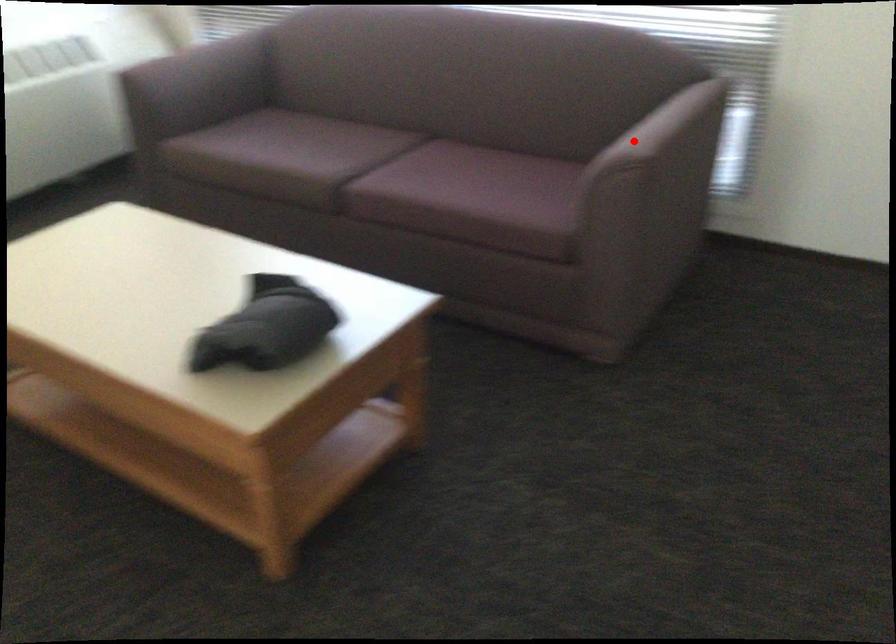
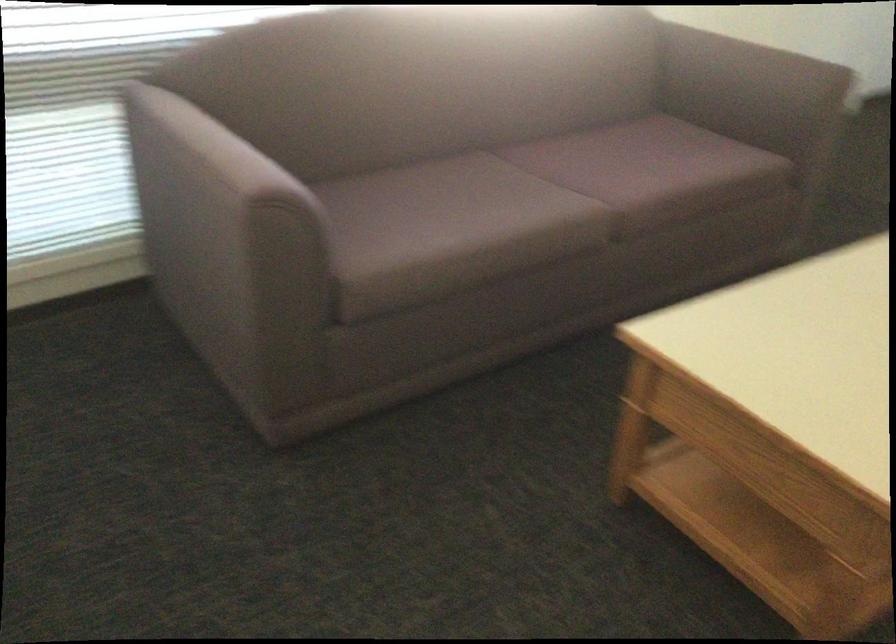
Question: I am providing you with two images of the same scene from different viewpoints. Given a red point in image1, look at the same physical point in image2. Is it:

Choices:
 (A) Closer to the viewpoint
 (B) Farther from the viewpoint

Answer: (B)